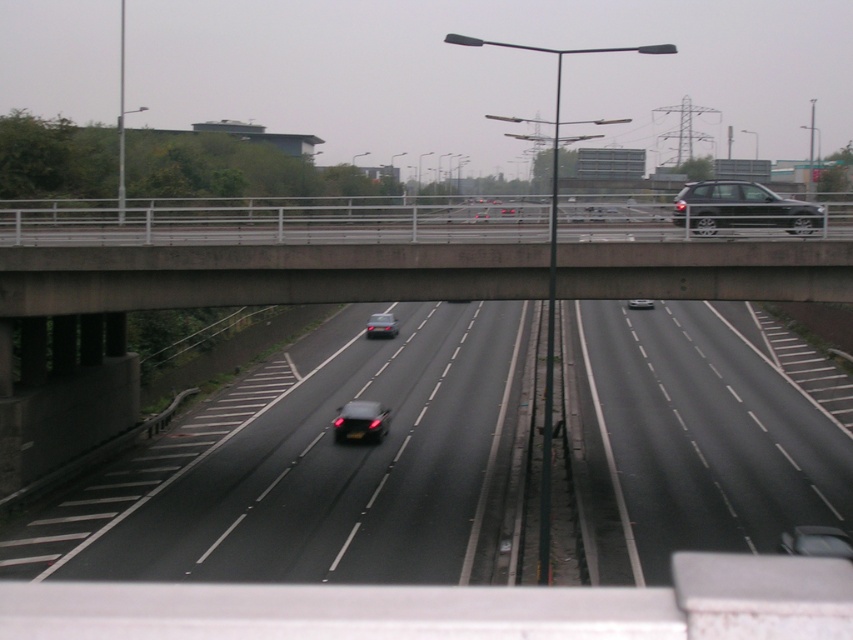
In the scene shown: You are a drone operator trying to capture a photo of the black asphalt highway at center from above. Given the presence of the overhead bridge, can you confirm if there is enough vertical clearance for the drone to fly over the bridge and still get a clear shot of the highway?

The black asphalt highway at center is located at point coordinates, but without specific height measurements of the bridge or the drone altitude requirements, it is impossible to determine vertical clearance. Additional information is needed to confirm if the drone can safely fly over the bridge while capturing the highway.

You are a drone operator trying to capture a photo of the concrete bridge at center. You need to position your drone at point A, which is at coordinates (262, 253). Will your drone be directly above the concrete bridge at center?

Yes, because the concrete bridge at center is located exactly at point (262, 253).

You are a drone operator trying to land a drone on the black asphalt highway at center. You have a target point at point (x=329, y=468). Is the target point on the black asphalt highway at center?

Yes, the point (x=329, y=468) is on the black asphalt highway at center, so the drone can land there.